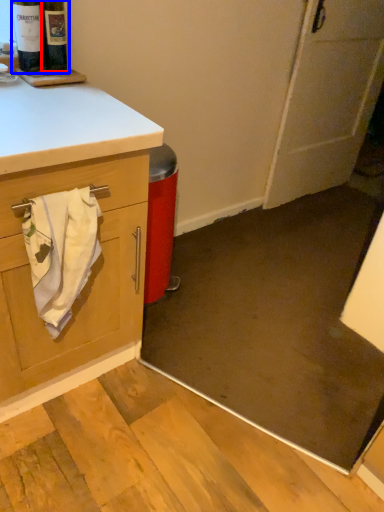
Question: Which of the following is the closest to the observer, wine bottle (highlighted by a red box) or beer bottle (highlighted by a blue box)?

Choices:
 (A) wine bottle
 (B) beer bottle

Answer: (B)